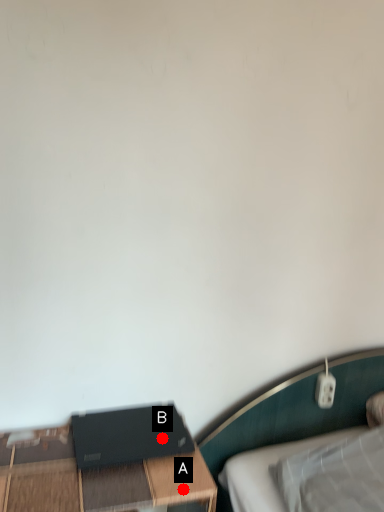
Question: Two points are circled on the image, labeled by A and B beside each circle. Which point is closer to the camera?

Choices:
 (A) A is closer
 (B) B is closer

Answer: (A)